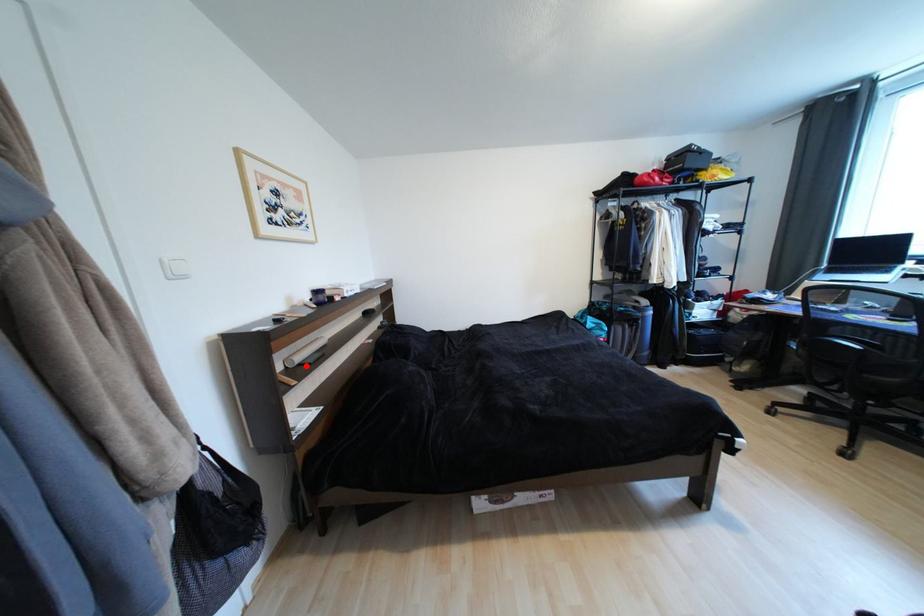
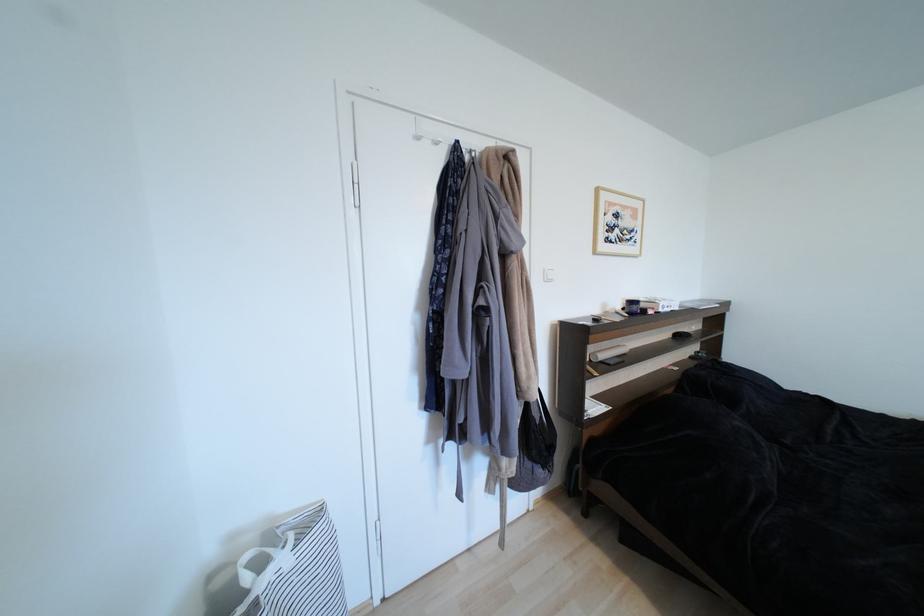
Locate, in the second image, the point that corresponds to the highlighted location in the first image.

(608, 363)